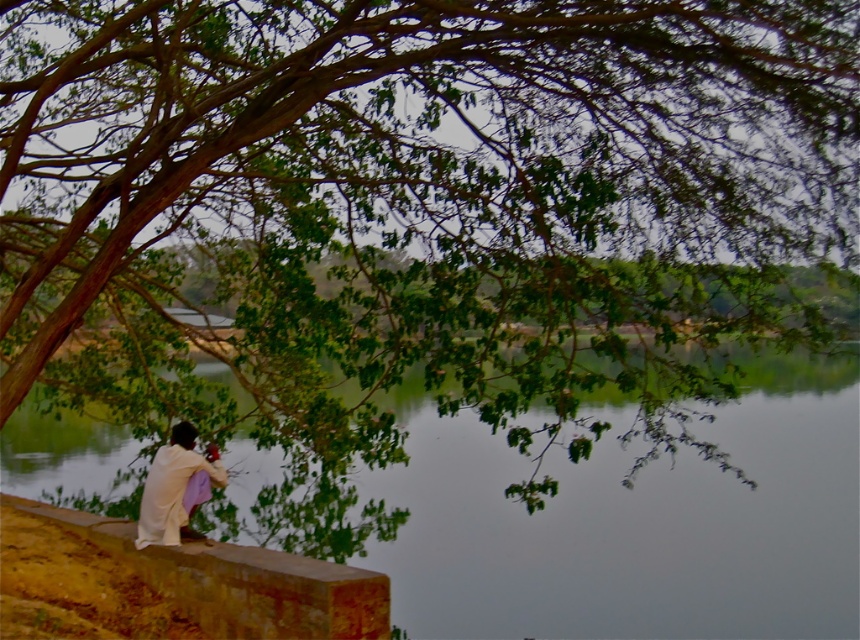
Can you confirm if smooth stone ledge at lower left is positioned to the left of white cotton cloth at lower left?

Yes, smooth stone ledge at lower left is to the left of white cotton cloth at lower left.

Between smooth stone ledge at lower left and white cotton cloth at lower left, which one has more height?

white cotton cloth at lower left

Measure the distance between smooth stone ledge at lower left and camera.

The distance of smooth stone ledge at lower left from camera is 7.30 meters.

The image size is (860, 640). What are the coordinates of `smooth stone ledge at lower left` in the screenshot? It's located at (169, 584).

Which of these two, green smooth water at center or smooth stone ledge at lower left, stands taller?

With more height is green smooth water at center.

What do you see at coordinates (633, 522) in the screenshot? I see `green smooth water at center` at bounding box center [633, 522].

The image size is (860, 640). I want to click on green smooth water at center, so click(633, 522).

How distant is green smooth water at center from white cotton cloth at lower left?

green smooth water at center is 3.15 meters away from white cotton cloth at lower left.

Locate an element on the screen. green smooth water at center is located at coordinates (633, 522).

Locate an element on the screen. green smooth water at center is located at coordinates (633, 522).